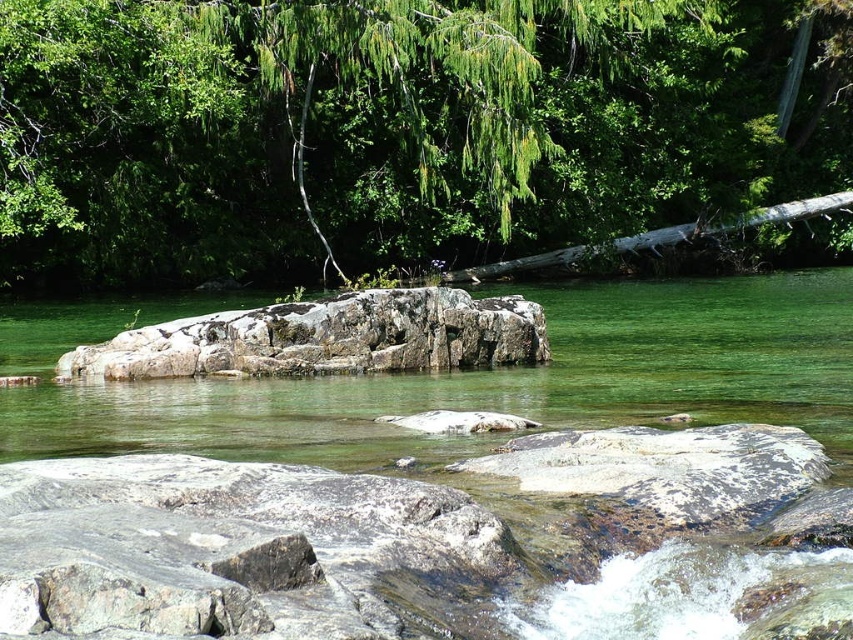
Between point (51, 13) and point (519, 314), which one is positioned behind?

The point (51, 13) is behind.

Between green leafy tree at upper center and gray rock at center, which one is positioned lower?

gray rock at center

Who is more forward, (236, 17) or (437, 289)?

Point (437, 289) is more forward.

At what (x,y) coordinates should I click in order to perform the action: click on green leafy tree at upper center. Please return your answer as a coordinate pair (x, y). This screenshot has width=853, height=640. Looking at the image, I should click on (398, 129).